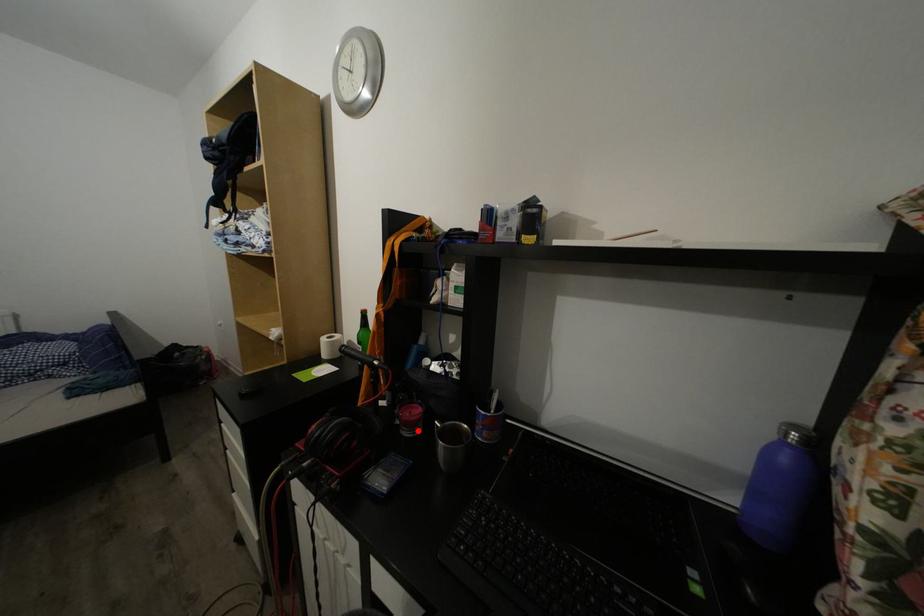
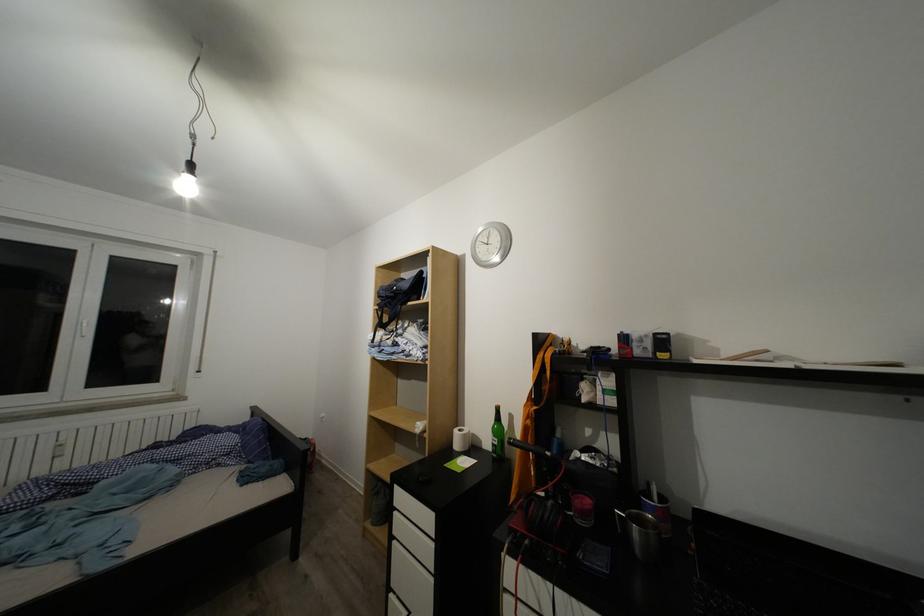
The point at the highlighted location is marked in the first image. Where is the corresponding point in the second image?

(590, 520)